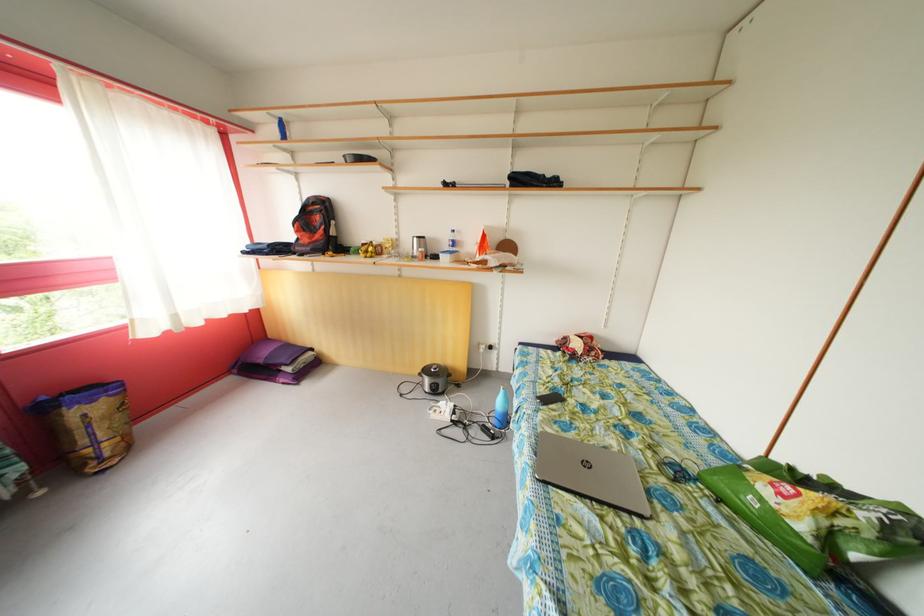
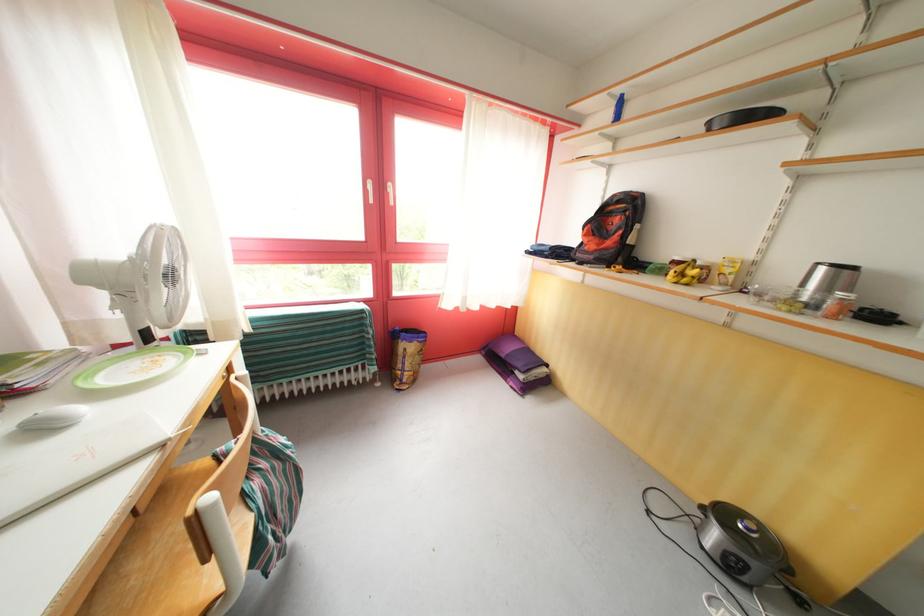
Locate, in the second image, the point that corresponds to point (371, 248) in the first image.

(684, 264)